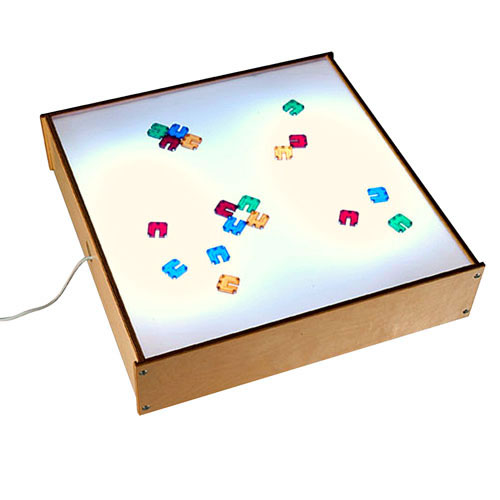
Identify the location of green tile. (163, 133), (293, 111), (252, 203), (398, 223).